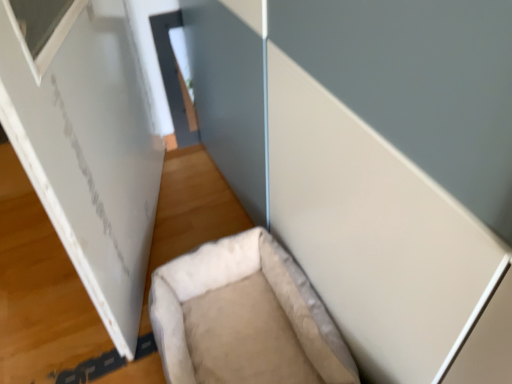
Question: From their relative heights in the image, would you say beige fabric pet bed at lower center is taller or shorter than white matte board at left?

Choices:
 (A) tall
 (B) short

Answer: (B)

Question: Considering the positions of beige fabric pet bed at lower center and white matte board at left in the image, is beige fabric pet bed at lower center bigger or smaller than white matte board at left?

Choices:
 (A) small
 (B) big

Answer: (A)

Question: From the image's perspective, is beige fabric pet bed at lower center positioned above or below white matte board at left?

Choices:
 (A) below
 (B) above

Answer: (A)

Question: Looking at the image, does white matte board at left seem bigger or smaller compared to beige fabric pet bed at lower center?

Choices:
 (A) big
 (B) small

Answer: (A)

Question: In terms of height, does white matte board at left look taller or shorter compared to beige fabric pet bed at lower center?

Choices:
 (A) short
 (B) tall

Answer: (B)

Question: Looking at their shapes, would you say white matte board at left is wider or thinner than beige fabric pet bed at lower center?

Choices:
 (A) thin
 (B) wide

Answer: (A)

Question: From a real-world perspective, is white matte board at left above or below beige fabric pet bed at lower center?

Choices:
 (A) below
 (B) above

Answer: (B)